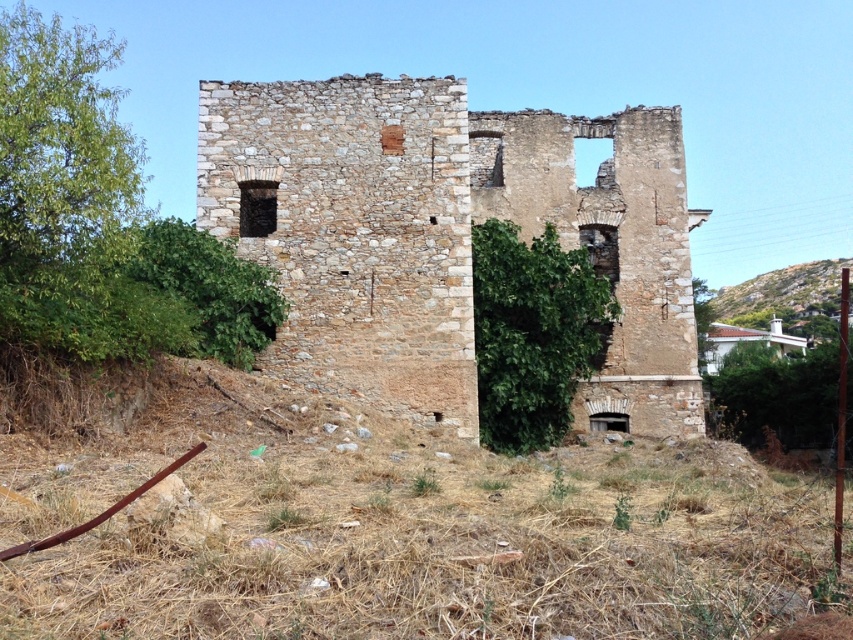
From the picture: You are a hiker who wants to take a shortcut through the rustic stone ruins at center and the green leafy bush at center. Which one should you avoid stepping on to prevent damaging the environment?

You should avoid stepping on the green leafy bush at center because it is a living plant, while the rustic stone ruins at center are nonliving structures.

You are standing in the middle of a rural area and see the image. There is a point marked at coordinates (445, 236). According to the scene description, what does this point most likely represent?

The point at (445, 236) most likely represents the rustic stone ruins at center as described in the scene.